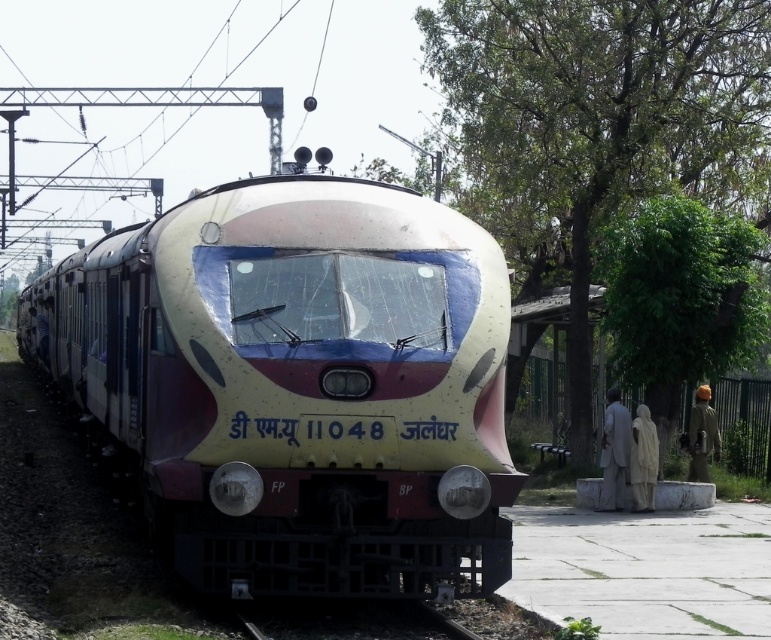
Consider the image. You are a traveler at the railway station and see two fabrics on the right side of the platform. Which fabric is positioned more to the left between the white fabric at right and the brown fabric turban at right?

The white fabric at right is positioned to the left of the brown fabric turban at right.